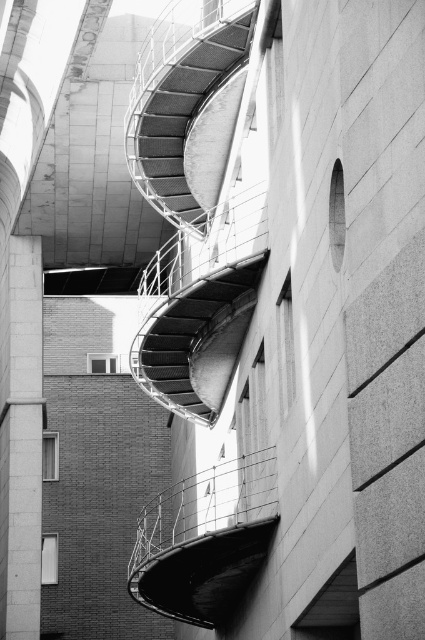
Question: Among these objects, which one is farthest from the camera?

Choices:
 (A) metallic mesh staircase at center
 (B) metallic wire balustrade at center

Answer: (A)

Question: Does metallic mesh staircase at center appear under metallic mesh staircase at upper center?

Choices:
 (A) yes
 (B) no

Answer: (B)

Question: Does metallic mesh staircase at center have a lesser width compared to metallic mesh staircase at upper center?

Choices:
 (A) yes
 (B) no

Answer: (B)

Question: Which of the following is the closest to the observer?

Choices:
 (A) (257, 556)
 (B) (161, 141)
 (C) (220, 285)

Answer: (A)

Question: Which is farther from the metallic mesh staircase at center?

Choices:
 (A) metallic wire balustrade at center
 (B) metallic mesh staircase at upper center

Answer: (A)

Question: Does metallic mesh staircase at center lie in front of metallic mesh staircase at upper center?

Choices:
 (A) yes
 (B) no

Answer: (B)